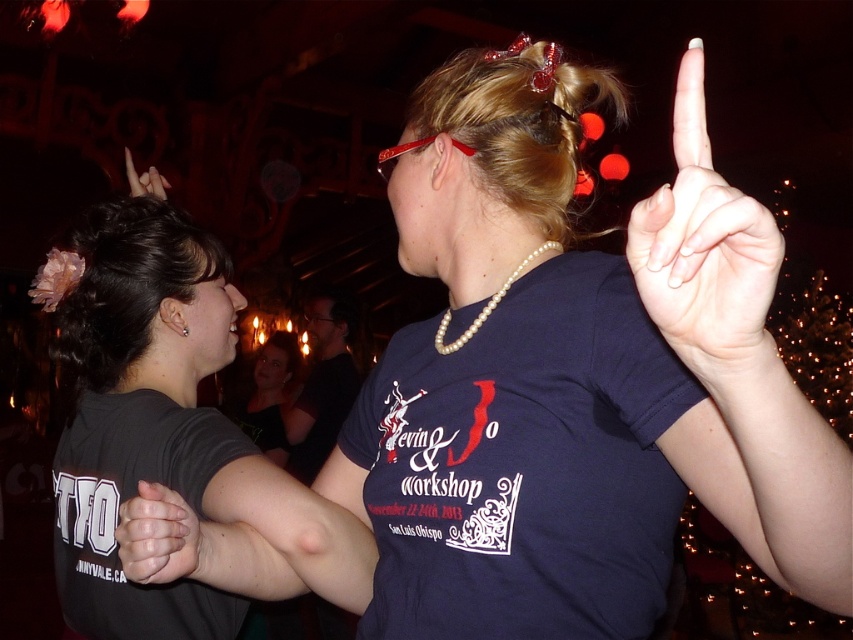
You are a photographer at the event and need to adjust your camera to capture both the black matte shirt at upper left and the pearl necklace at center in focus. The camera can only focus on objects within 20 inches of each other. Can you capture both in focus?

The distance between the black matte shirt at upper left and pearl necklace at center is 24.43 inches, which exceeds the camera focus range of 20 inches. Therefore, both cannot be in focus simultaneously.

You are an artist analyzing the image for a project. You notice two objects labeled as matte black hands at center and matte black hand at upper left. Which of these two objects has a smaller width?

The matte black hands at center has a smaller width than the matte black hand at upper left.

You are attending a dance event and notice two people wearing black shirts. The first is wearing a black matte shirt at upper left, and the second is wearing a matte black shirt at center. From your perspective, which of these two shirts appears taller?

The black matte shirt at upper left appears taller than the matte black shirt at center.